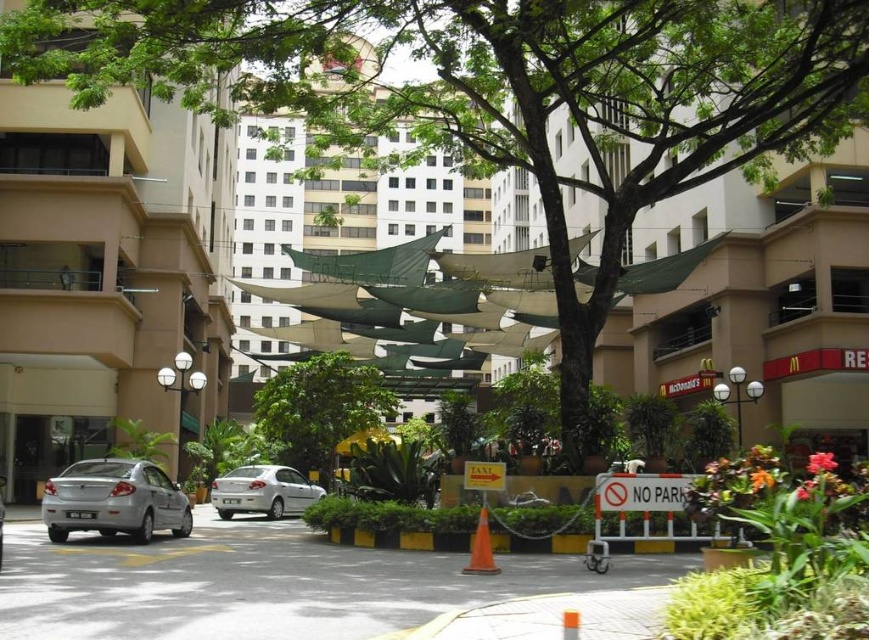
You are a delivery driver who needs to park your van between the silver metallic car at lower left and the silver metallic sedan at center. Is there enough space between them for your van?

The silver metallic car at lower left is positioned over the silver metallic sedan at center, meaning they are directly on top of each other. Since they are overlapping, there is no space between them for your van to park.

You are a delivery driver who needs to park your van between the beige concrete building at left and the silver metallic car at lower left. Can you fit your van there?

The beige concrete building at left is positioned on the left side of the silver metallic car at lower left, so there is space between them for your van to park.